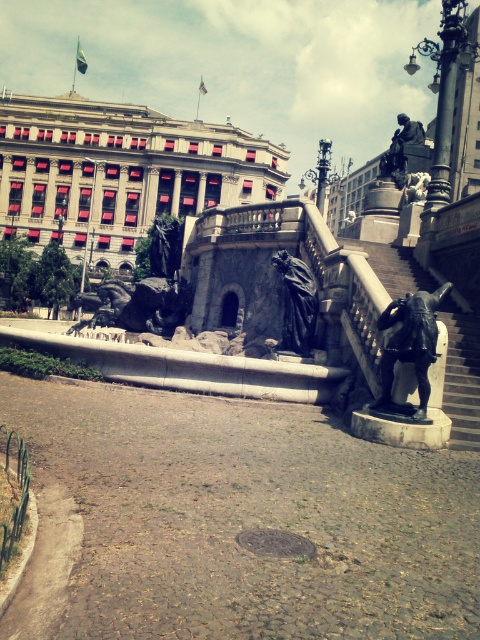
You are an architect examining the historical urban scene. You notice the matte red building at upper left and the black polished stone statue at center. Which object is positioned higher in the image?

The matte red building at upper left is above the black polished stone statue at center, so it is positioned higher in the image.

You are standing at the base of the staircase in the historical urban scene. You notice two points marked on the image, point 1 at coordinates point (x=37, y=212) and point 2 at coordinates point (x=301, y=269). Which point is closer to you?

Point 1 at coordinates point (x=37, y=212) is closer to you because it is further to the viewer than point 2 at coordinates point (x=301, y=269).

You are an art student standing at the bottom of the staircase in the image. You want to take a photo of both the black polished statue at center and the black polished stone statue at center. Which statue should you aim your camera upwards to capture?

You should aim your camera upwards to capture the black polished stone statue at center because it is located above the black polished statue at center.